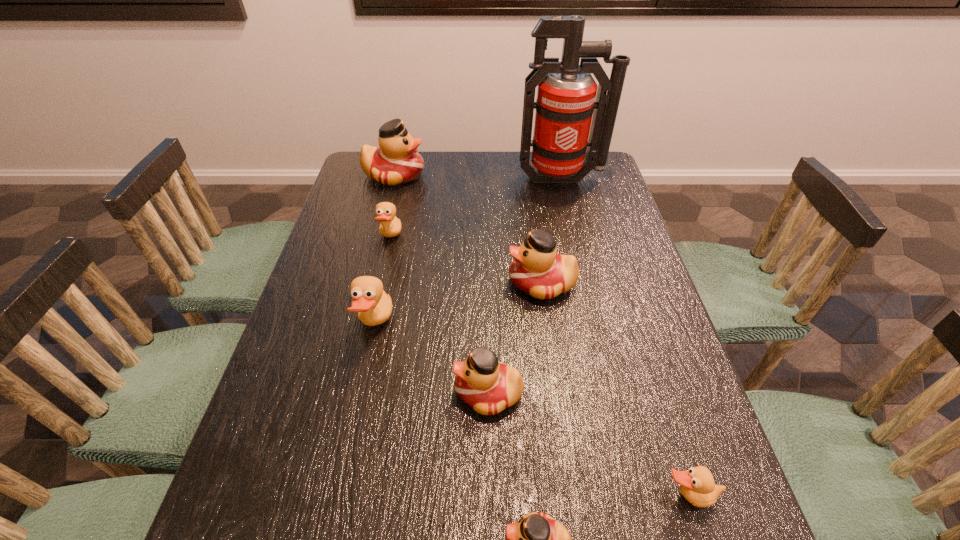
Find the location of a particular element. free space located on the face of the third biggest red duck is located at coordinates (346, 393).

Find the location of `vacant space positioned 0.200m on the beak of the second biggest tan duck`. vacant space positioned 0.200m on the beak of the second biggest tan duck is located at coordinates (469, 239).

Locate an element on the screen. Image resolution: width=960 pixels, height=540 pixels. fire extinguisher that is positioned at the far edge is located at coordinates pos(566,94).

The height and width of the screenshot is (540, 960). In order to click on duck situated at the far edge in this screenshot , I will do `click(396, 161)`.

Where is `fire extinguisher that is at the right edge`? fire extinguisher that is at the right edge is located at coordinates (566, 94).

Where is `duck present at the right edge`? The height and width of the screenshot is (540, 960). duck present at the right edge is located at coordinates (697, 485).

Image resolution: width=960 pixels, height=540 pixels. I want to click on object present at the far left corner, so click(396, 161).

This screenshot has height=540, width=960. Identify the location of object that is positioned at the far right corner. [x=566, y=94].

Locate an element on the screen. vacant space at the far edge of the desktop is located at coordinates (439, 186).

Find the location of a particular element. vacant space at the left edge of the desktop is located at coordinates (354, 224).